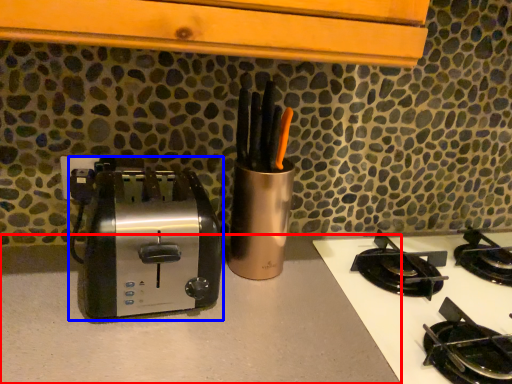
Question: Which of the following is the farthest to the observer, counter top (highlighted by a red box) or toaster (highlighted by a blue box)?

Choices:
 (A) counter top
 (B) toaster

Answer: (B)